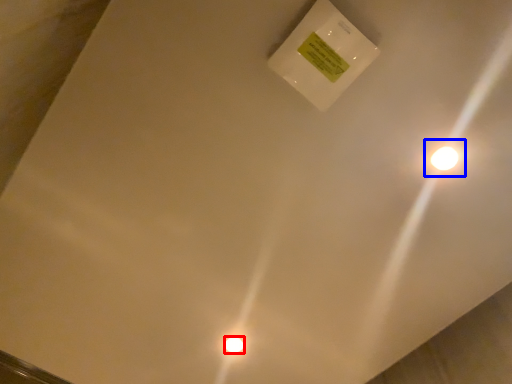
Question: Which point is closer to the camera, light bulb (highlighted by a red box) or light (highlighted by a blue box)?

Choices:
 (A) light bulb
 (B) light

Answer: (B)